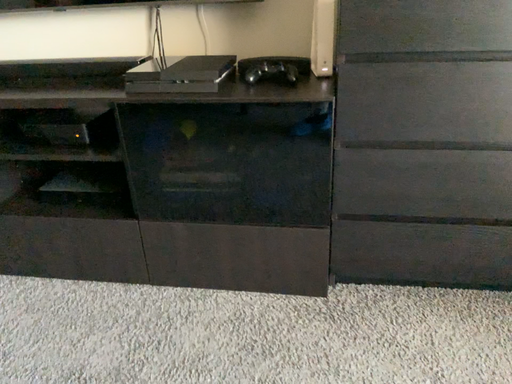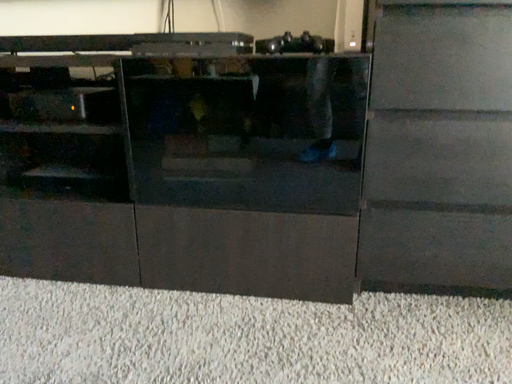
Question: How did the camera likely rotate when shooting the video?

Choices:
 (A) rotated downward
 (B) rotated upward

Answer: (B)